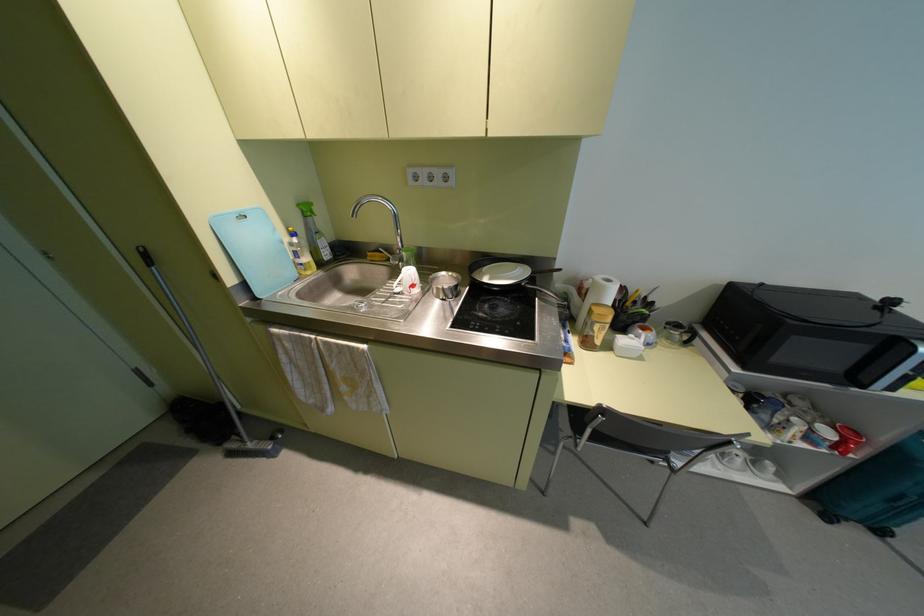
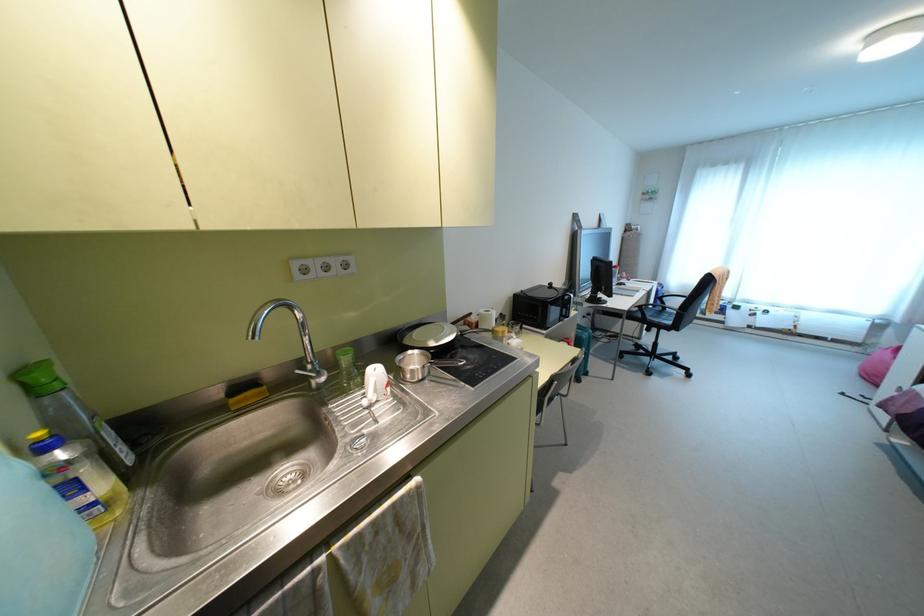
In the second image, find the point that corresponds to point 297,205 in the first image.

(20, 374)